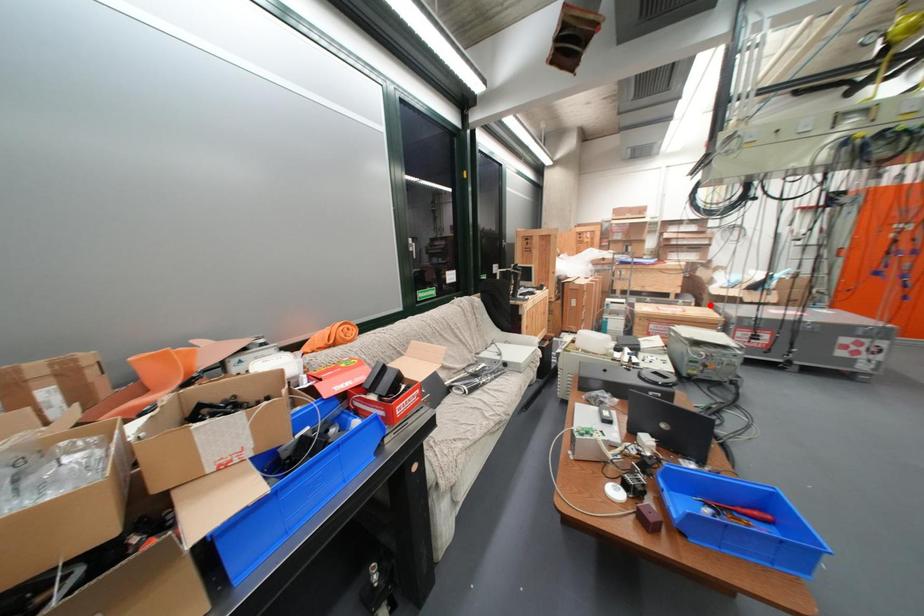
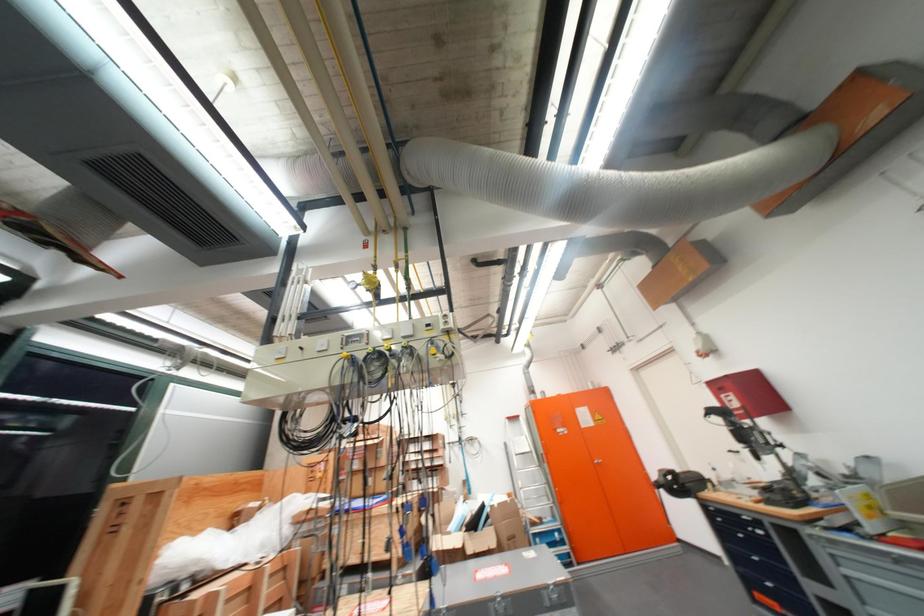
Locate, in the second image, the point that corresponds to the highlighted location in the first image.

(438, 573)